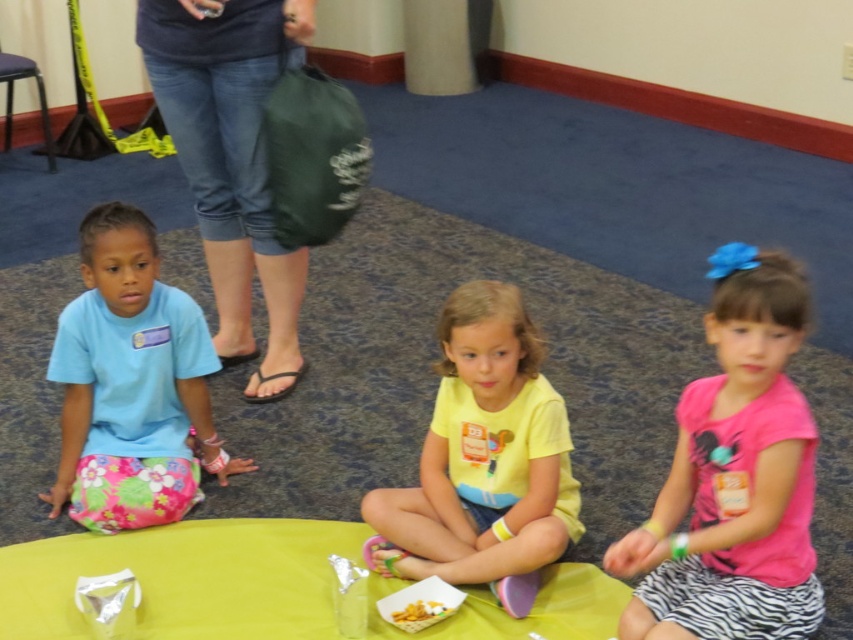
You are a photographer trying to capture a closeup of the yellow matte snack at center. There is a child wearing the yellow matte shirt at center blocking your view. Which direction should you move the child to get a clear shot of the snack?

The yellow matte shirt at center is positioned on the right side of the yellow matte snack at center. To get a clear shot of the snack, move the child wearing the yellow matte shirt at center to the left.

You are a photographer taking a picture of the scene. The yellow matte shirt at center is represented by point (483, 460). Where should you focus your camera to capture the yellow matte shirt at center clearly?

You should focus your camera on point (483, 460) to capture the yellow matte shirt at center clearly.

You are a parent trying to identify which item is closer to your child. You see a yellow matte shirt at center and a yellow matte snack at center. Which one is taller?

The yellow matte shirt at center is taller than the yellow matte snack at center, so the shirt is taller.